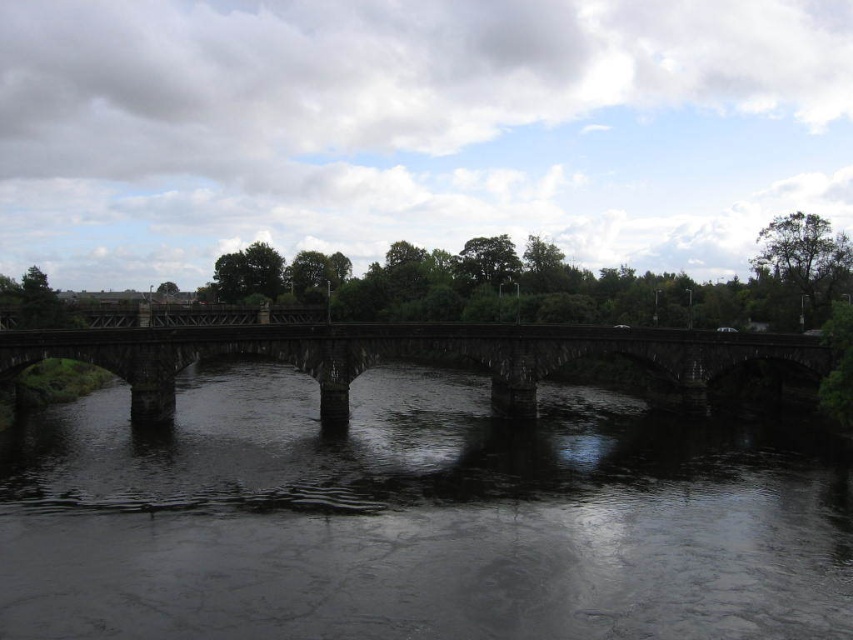
Is point (498, 477) closer to camera compared to point (498, 365)?

Yes, point (498, 477) is closer to viewer.

Does dark gray stone bridge at center have a smaller size compared to dark stone bridge at center?

Yes, dark gray stone bridge at center is smaller than dark stone bridge at center.

Between point (492, 516) and point (697, 374), which one is positioned behind?

The point (697, 374) is more distant.

I want to click on dark gray stone bridge at center, so click(x=416, y=518).